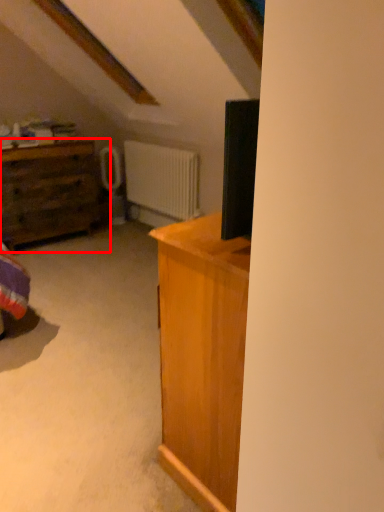
Question: Observing the image, what is the correct spatial positioning of chest of drawers (annotated by the red box) in reference to radiator?

Choices:
 (A) right
 (B) left

Answer: (B)